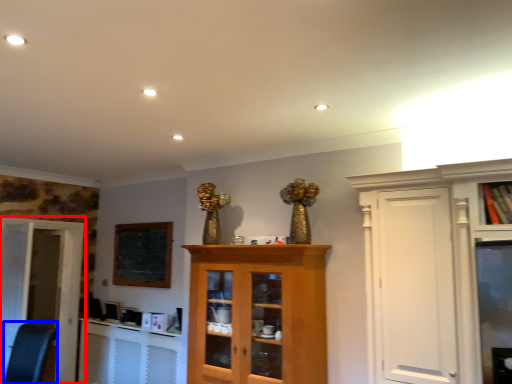
Question: Which object is further to the camera taking this photo, door (highlighted by a red box) or swivel chair (highlighted by a blue box)?

Choices:
 (A) door
 (B) swivel chair

Answer: (A)